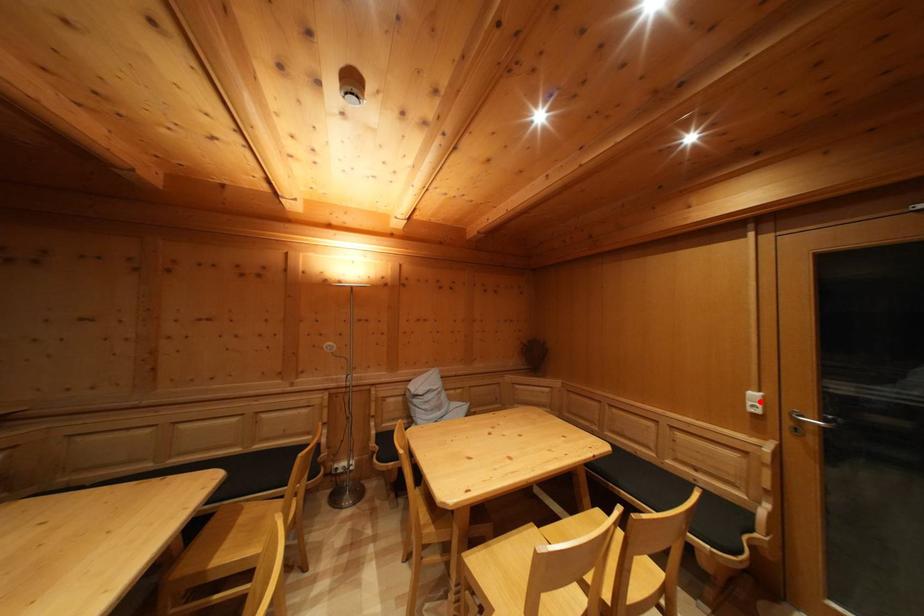
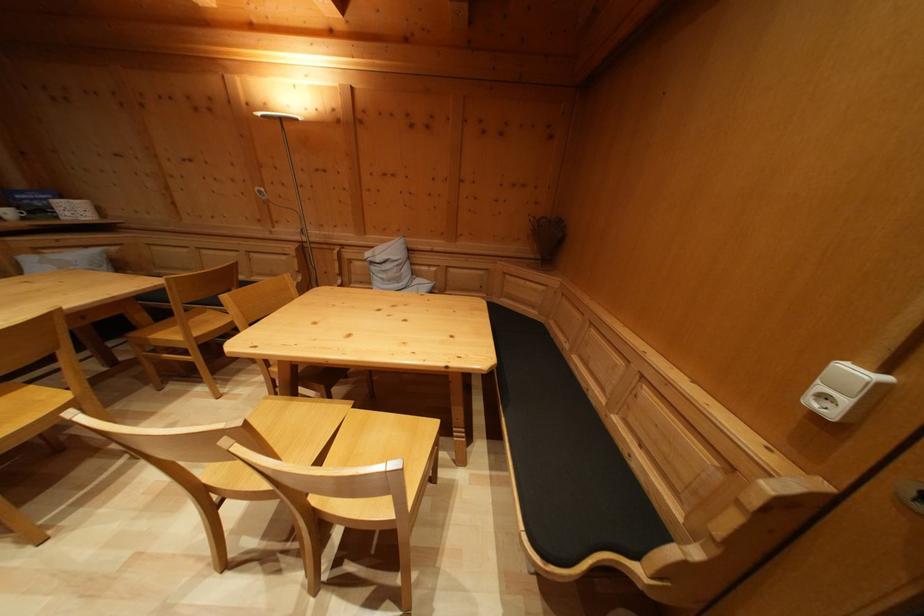
Question: I am providing you with two images of the same scene from different viewpoints. A red point is marked on the first image. Is the red point's position out of view in image 2?

Choices:
 (A) Yes
 (B) No

Answer: (B)